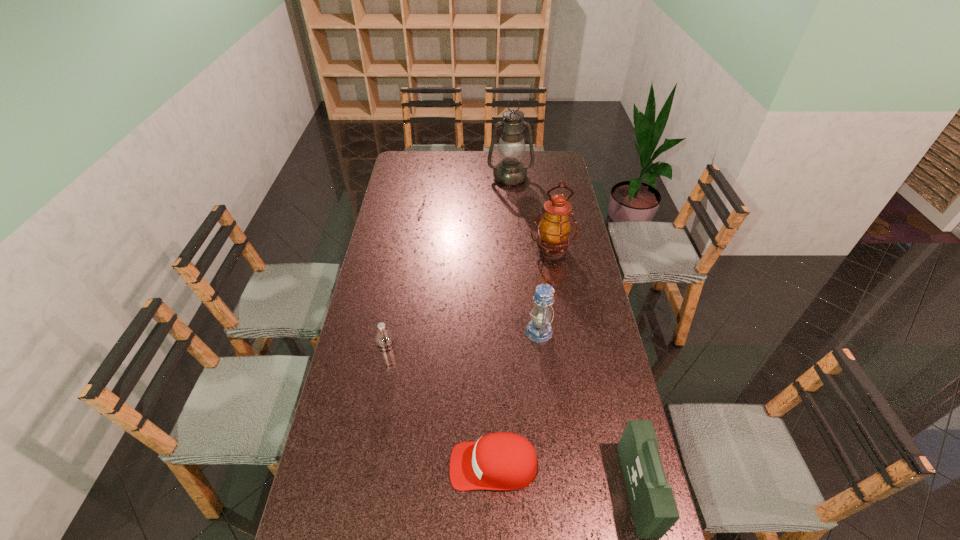
Identify the location of free space located 0.150m on the front-facing side of the shortest object. (397, 465).

Locate an element on the screen. vacant space located 0.150m on the front-facing side of the shortest object is located at coordinates (397, 465).

What are the coordinates of `object situated at the far edge` in the screenshot? It's located at (510, 171).

Identify the location of object at the left edge. Image resolution: width=960 pixels, height=540 pixels. coord(384,338).

At what (x,y) coordinates should I click in order to perform the action: click on oil lamp that is at the right edge. Please return your answer as a coordinate pair (x, y). Image resolution: width=960 pixels, height=540 pixels. Looking at the image, I should click on (554, 229).

You are a GUI agent. You are given a task and a screenshot of the screen. Output one action in this format:
    pyautogui.click(x=<x>, y=<y>)
    Task: Click on the first-aid kit situated at the right edge
    The width and height of the screenshot is (960, 540).
    Given the screenshot: What is the action you would take?
    pyautogui.click(x=654, y=510)

You are a GUI agent. You are given a task and a screenshot of the screen. Output one action in this format:
    pyautogui.click(x=<x>, y=<y>)
    Task: Click on the vacant space at the far edge of the desktop
    The width and height of the screenshot is (960, 540).
    Given the screenshot: What is the action you would take?
    pyautogui.click(x=433, y=152)

The image size is (960, 540). What are the coordinates of `free space at the left edge` in the screenshot? It's located at (373, 487).

In the image, there is a desktop. Identify the location of vacant space at the right edge. (566, 261).

What are the coordinates of `vacant area at the far left corner` in the screenshot? It's located at pyautogui.click(x=406, y=168).